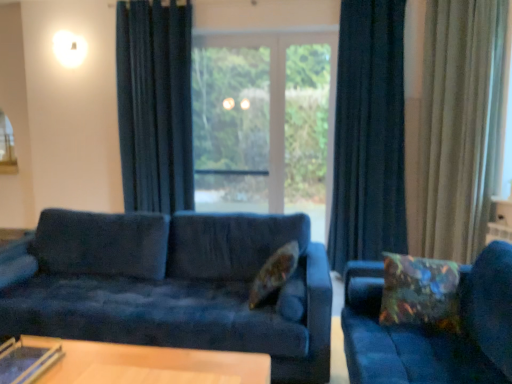
Question: Is multicolored fabric pillow at right, which appears as the 1th pillow when viewed from the right, taller or shorter than beige velvet curtain at right, the 3th curtain positioned from the left?

Choices:
 (A) tall
 (B) short

Answer: (B)

Question: From the image's perspective, is multicolored fabric pillow at right, which appears as the 1th pillow when viewed from the right, above or below beige velvet curtain at right, which is the first curtain in right-to-left order?

Choices:
 (A) above
 (B) below

Answer: (B)

Question: Which object is the farthest from the transparent glass table at lower left?

Choices:
 (A) dark blue velvet curtain at center, which is the 2th curtain from left to right
 (B) floral fabric pillow at center, which is counted as the 1th pillow, starting from the left
 (C) transparent glass screen door at center
 (D) transparent glass window at center
 (E) dark blue velvet curtain at center, arranged as the first curtain when viewed from the left

Answer: (C)

Question: Estimate the real-world distances between objects in this image. Which object is closer to the velvet blue couch at center, arranged as the 1th studio couch when viewed from the left?

Choices:
 (A) velvet blue couch at right, arranged as the first studio couch when viewed from the right
 (B) multicolored fabric pillow at right, which appears as the 1th pillow when viewed from the right
 (C) dark blue velvet curtain at center, the 3th curtain in the right-to-left sequence
 (D) dark blue velvet curtain at center, which is the 2th curtain from left to right
 (E) floral fabric pillow at center, which is counted as the 1th pillow, starting from the left

Answer: (E)